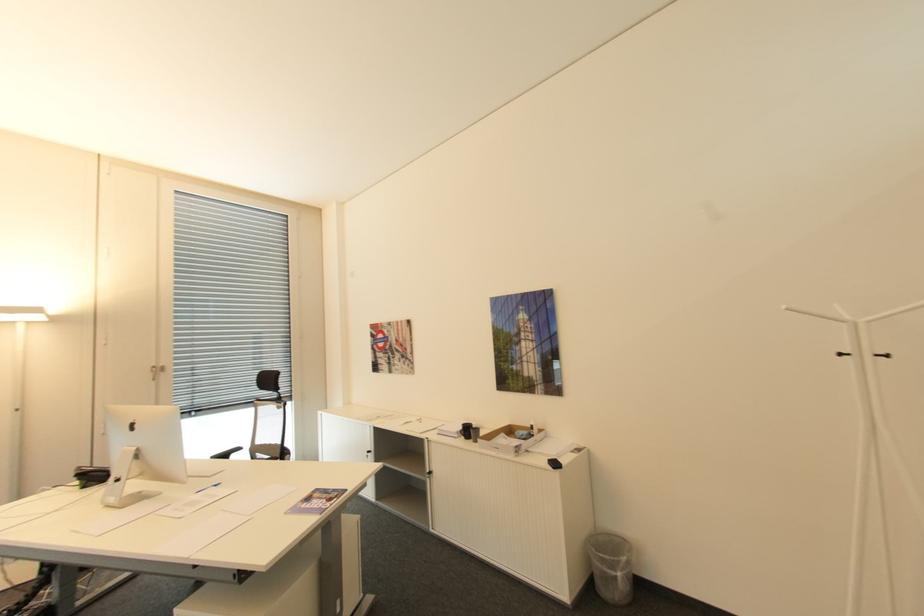
Where would you turn the silver door handle? Please return your answer as a coordinate pair (x, y).

(871, 451)